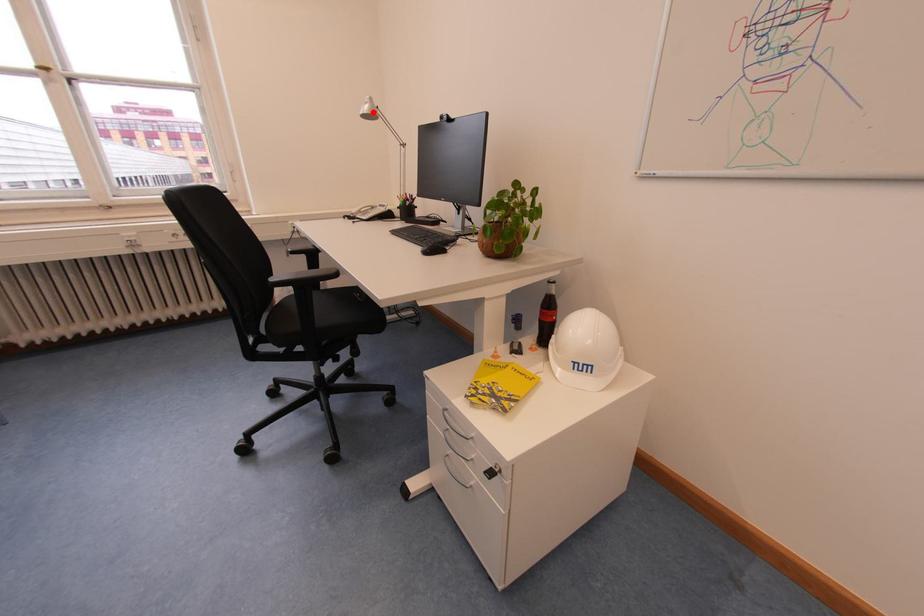
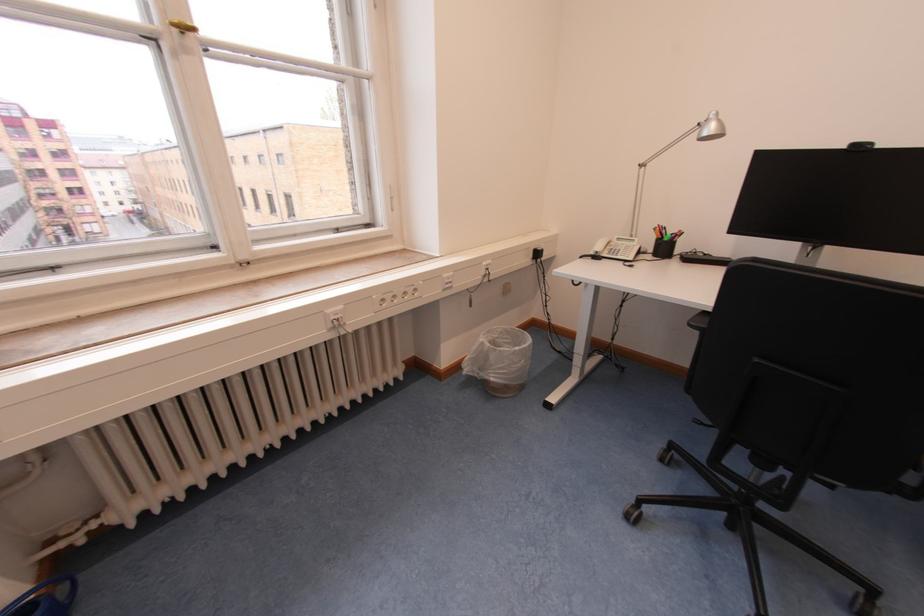
Find the pixel in the second image that matches the highlighted location in the first image.

(719, 130)